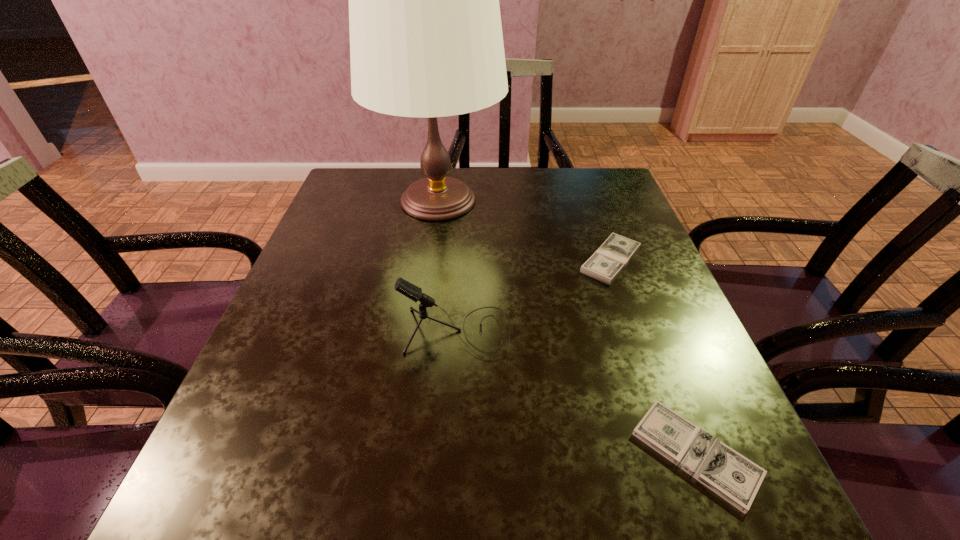
The height and width of the screenshot is (540, 960). In order to click on free space located 0.200m on the left of the nearest object in this screenshot , I will do `click(505, 454)`.

Locate an element on the screen. This screenshot has height=540, width=960. object located in the far edge section of the desktop is located at coordinates (426, 40).

The width and height of the screenshot is (960, 540). Identify the location of object at the near edge. (735, 478).

Find the location of a particular element. object that is at the left edge is located at coordinates (426, 40).

Find the location of a particular element. The width and height of the screenshot is (960, 540). object present at the far left corner is located at coordinates (426, 40).

Locate an element on the screen. This screenshot has width=960, height=540. object that is at the near right corner is located at coordinates (735, 478).

I want to click on vacant space at the far edge, so click(x=543, y=177).

This screenshot has width=960, height=540. Find the location of `vacant space at the near edge of the desktop`. vacant space at the near edge of the desktop is located at coordinates tap(513, 522).

Where is `blank area at the left edge`? Image resolution: width=960 pixels, height=540 pixels. blank area at the left edge is located at coordinates (257, 436).

This screenshot has width=960, height=540. I want to click on vacant area at the right edge of the desktop, so click(x=632, y=413).